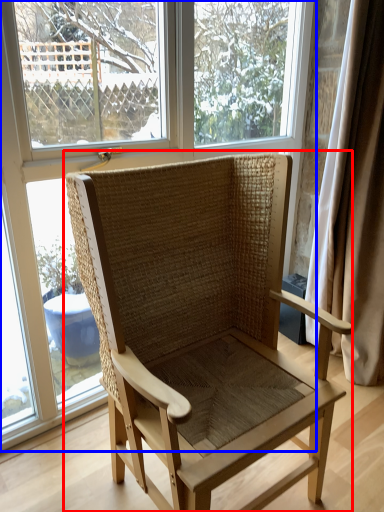
Question: Among these objects, which one is farthest to the camera, chair (highlighted by a red box) or window (highlighted by a blue box)?

Choices:
 (A) chair
 (B) window

Answer: (B)